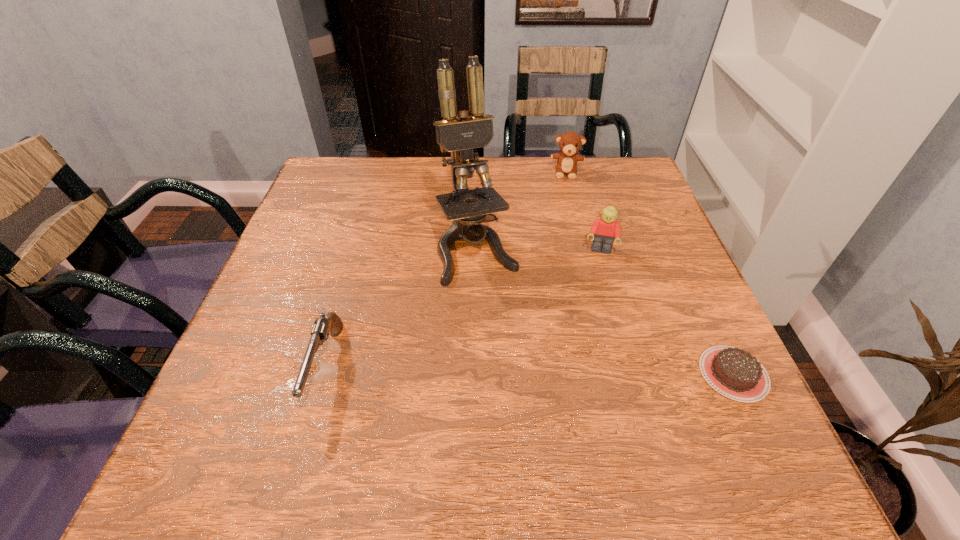
Where is `free space on the desktop that is between the gun and the rightmost object and is positioned at the eyepieces of the microscope`? free space on the desktop that is between the gun and the rightmost object and is positioned at the eyepieces of the microscope is located at coordinates (529, 370).

At what (x,y) coordinates should I click in order to perform the action: click on free space on the desktop that is between the leftmost object and the shortest object and is positioned on the face of the teddy bear. Please return your answer as a coordinate pair (x, y). This screenshot has height=540, width=960. Looking at the image, I should click on (557, 370).

Identify the location of free space on the desktop that is between the leftmost object and the chocolate cake and is positioned on the face of the Lego. The image size is (960, 540). (586, 371).